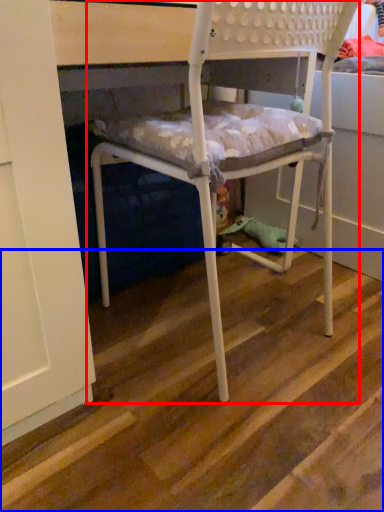
Question: Among these objects, which one is farthest to the camera, chair (highlighted by a red box) or stair (highlighted by a blue box)?

Choices:
 (A) chair
 (B) stair

Answer: (A)